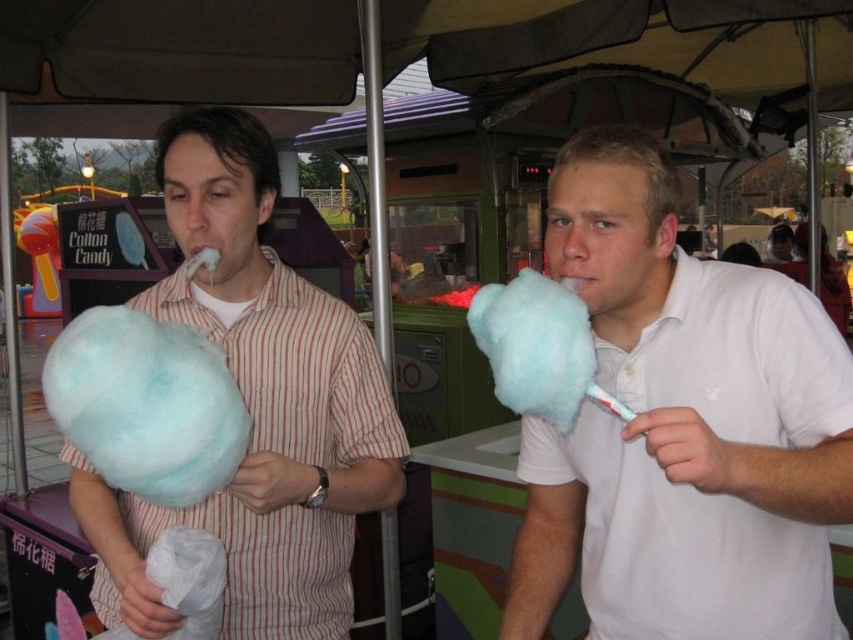
You are at a fair and see two cotton candies. The white cotton candy at center and the matte cotton candy at left. Which one is directly above the other?

The matte cotton candy at left is directly above the white cotton candy at center because the white cotton candy at center is positioned under matte cotton candy at left.

What is the location of the point with coordinates (x=254, y=406) in the image?

The point with coordinates (x=254, y=406) is located on the matte cotton candy at left.